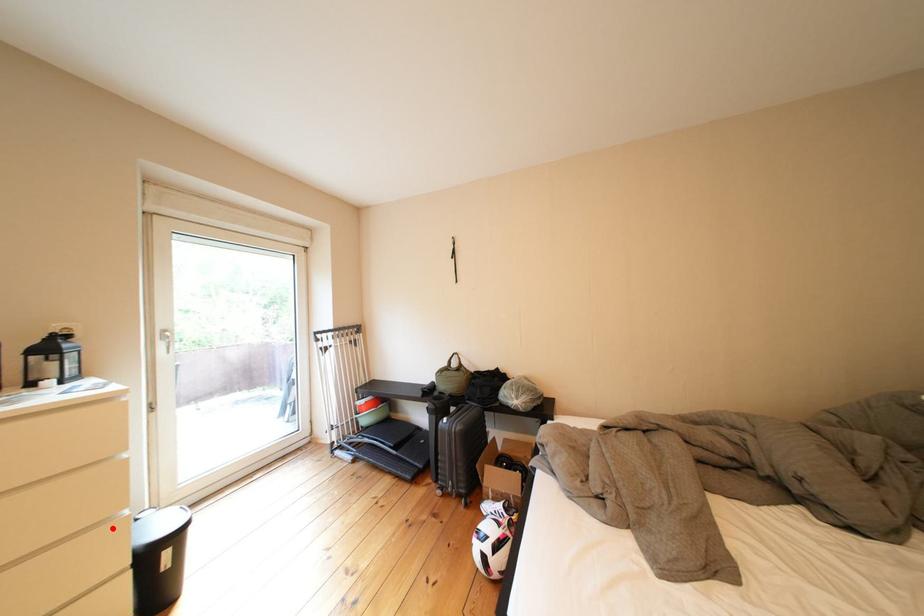
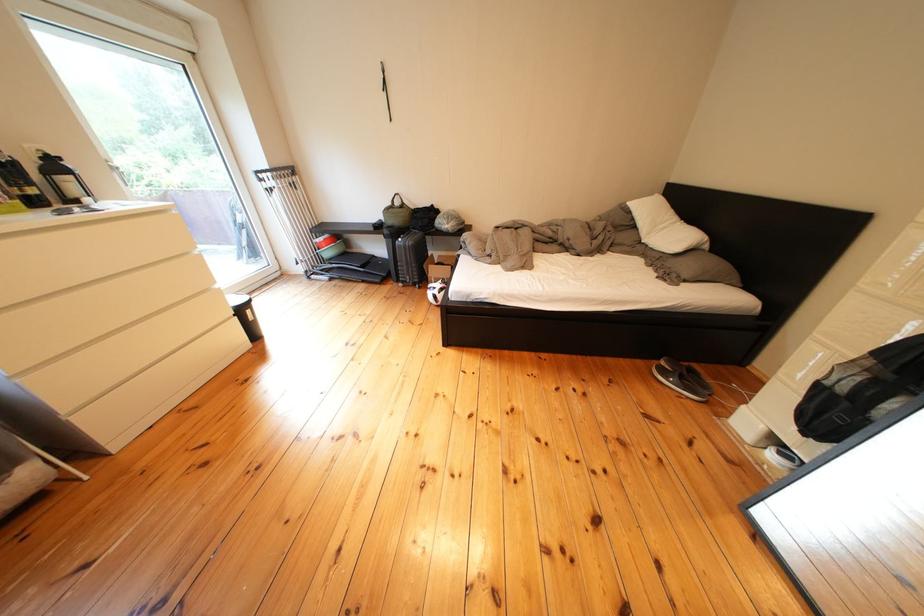
Question: I am providing you with two images of the same scene from different viewpoints. Image1 has a red point marked. In image2, the corresponding 3D location appears at what relative position? Reply with the corresponding letter.

Choices:
 (A) Closer
 (B) Farther

Answer: (A)